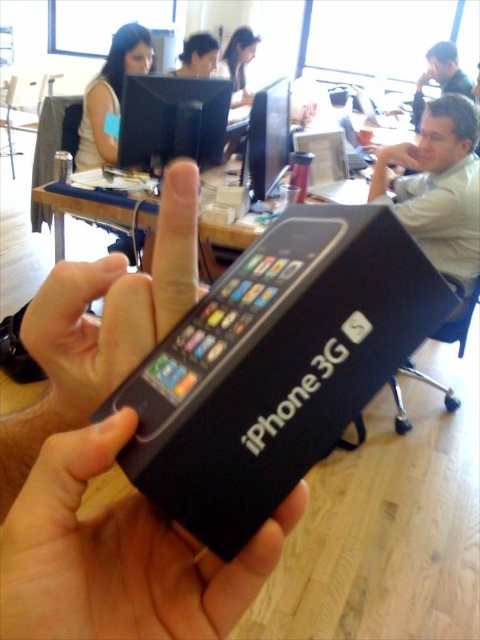
Question: Which object appears farthest from the camera in this image?

Choices:
 (A) black matte iphone 3g at center
 (B) black matte iphone at center

Answer: (A)

Question: Considering the relative positions of matte white shirt at upper left and dark brown hair at upper center in the image provided, where is matte white shirt at upper left located with respect to dark brown hair at upper center?

Choices:
 (A) below
 (B) above

Answer: (A)

Question: Does black plastic monitor at upper center have a greater width compared to smooth skin face at upper center?

Choices:
 (A) yes
 (B) no

Answer: (A)

Question: Among these objects, which one is farthest from the camera?

Choices:
 (A) white shirt at upper right
 (B) light brown hair at upper right
 (C) matte white shirt at upper left
 (D) smooth skin face at upper center

Answer: (B)

Question: Does white shirt at upper right lie in front of black plastic monitor at upper center?

Choices:
 (A) yes
 (B) no

Answer: (B)

Question: Among these points, which one is farthest from the camera?

Choices:
 (A) (202, 45)
 (B) (78, 148)

Answer: (A)